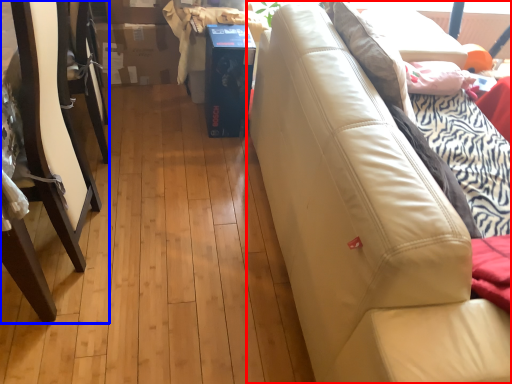
Question: Which object is further to the camera taking this photo, studio couch (highlighted by a red box) or furniture (highlighted by a blue box)?

Choices:
 (A) studio couch
 (B) furniture

Answer: (B)